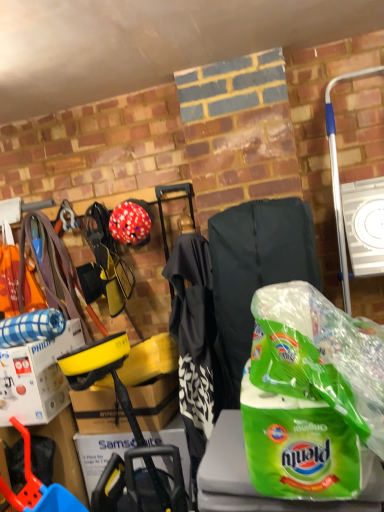
Question: Does white cardboard box at left lie behind green plastic bag at center?

Choices:
 (A) yes
 (B) no

Answer: (A)

Question: Does white cardboard box at left lie in front of green plastic bag at center?

Choices:
 (A) no
 (B) yes

Answer: (A)

Question: Is green plastic bag at center at the back of white cardboard box at left?

Choices:
 (A) no
 (B) yes

Answer: (A)

Question: Is white cardboard box at left shorter than green plastic bag at center?

Choices:
 (A) yes
 (B) no

Answer: (A)

Question: Is white cardboard box at left smaller than green plastic bag at center?

Choices:
 (A) yes
 (B) no

Answer: (A)

Question: Can you confirm if white cardboard box at left is positioned to the left of green plastic bag at center?

Choices:
 (A) no
 (B) yes

Answer: (B)

Question: Does white cardboard box at left have a lesser height compared to matte red helmet at center?

Choices:
 (A) no
 (B) yes

Answer: (A)

Question: From a real-world perspective, is white cardboard box at left below matte red helmet at center?

Choices:
 (A) yes
 (B) no

Answer: (A)

Question: Considering the relative positions of white cardboard box at left and matte red helmet at center in the image provided, is white cardboard box at left to the left of matte red helmet at center from the viewer's perspective?

Choices:
 (A) no
 (B) yes

Answer: (B)

Question: Is white cardboard box at left behind matte red helmet at center?

Choices:
 (A) no
 (B) yes

Answer: (A)

Question: Does white cardboard box at left have a greater width compared to matte red helmet at center?

Choices:
 (A) no
 (B) yes

Answer: (B)

Question: Could matte red helmet at center be considered to be inside white cardboard box at left?

Choices:
 (A) yes
 (B) no

Answer: (B)

Question: Is green plastic bag at center in front of matte red helmet at center?

Choices:
 (A) yes
 (B) no

Answer: (A)